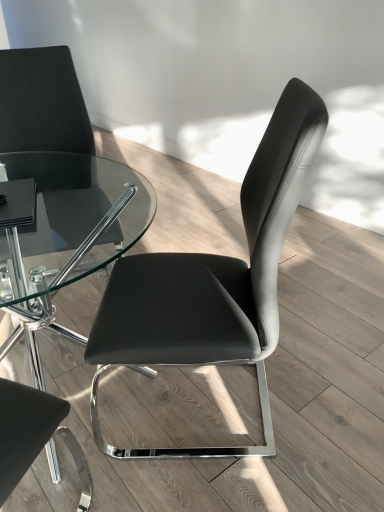
Measure the distance between black leather chair at upper left, the first chair in the left-to-right sequence, and camera.

black leather chair at upper left, the first chair in the left-to-right sequence, is 1.23 meters from camera.

In order to face black leather chair at upper left, the first chair in the left-to-right sequence, should I rotate leftwards or rightwards?

Turn left approximately 18.115 degrees to face it.

This screenshot has width=384, height=512. What do you see at coordinates (51, 181) in the screenshot? I see `black leather chair at upper left, which ranks as the second chair in right-to-left order` at bounding box center [51, 181].

This screenshot has height=512, width=384. Identify the location of black leather chair at upper left, which ranks as the second chair in right-to-left order. (51, 181).

Describe the element at coordinates (214, 282) in the screenshot. I see `black leather chair at center, the first chair viewed from the right` at that location.

This screenshot has width=384, height=512. In order to click on black leather chair at center, the first chair viewed from the right in this screenshot , I will do pyautogui.click(x=214, y=282).

Find the location of `black leather chair at upper left, which ranks as the second chair in right-to-left order`. black leather chair at upper left, which ranks as the second chair in right-to-left order is located at coordinates (51, 181).

Considering the relative positions of black leather chair at center, which is the 2th chair from left to right, and black leather chair at upper left, which ranks as the second chair in right-to-left order, in the image provided, is black leather chair at center, which is the 2th chair from left to right, to the left of black leather chair at upper left, which ranks as the second chair in right-to-left order, from the viewer's perspective?

No, black leather chair at center, which is the 2th chair from left to right, is not to the left of black leather chair at upper left, which ranks as the second chair in right-to-left order.

Between black leather chair at center, which is the 2th chair from left to right, and black leather chair at upper left, which ranks as the second chair in right-to-left order, which one is positioned in front?

black leather chair at center, which is the 2th chair from left to right, is more forward.

Considering the positions of points (147, 317) and (38, 58), is point (147, 317) farther from camera compared to point (38, 58)?

No, it is in front of (38, 58).

From the image's perspective, between black leather chair at center, which is the 2th chair from left to right, and black leather chair at upper left, the first chair in the left-to-right sequence, who is located below?

black leather chair at center, which is the 2th chair from left to right, from the image's perspective.

From a real-world perspective, is black leather chair at center, the first chair viewed from the right, physically above black leather chair at upper left, the first chair in the left-to-right sequence?

Yes.

Is black leather chair at center, which is the 2th chair from left to right, thinner than black leather chair at upper left, the first chair in the left-to-right sequence?

No.

Is black leather chair at center, which is the 2th chair from left to right, taller or shorter than black leather chair at upper left, which ranks as the second chair in right-to-left order?

Considering their sizes, black leather chair at center, which is the 2th chair from left to right, has less height than black leather chair at upper left, which ranks as the second chair in right-to-left order.

Which of these two, black leather chair at center, which is the 2th chair from left to right, or black leather chair at upper left, the first chair in the left-to-right sequence, is smaller?

With smaller size is black leather chair at center, which is the 2th chair from left to right.

Is black leather chair at center, the first chair viewed from the right, inside or outside of black leather chair at upper left, which ranks as the second chair in right-to-left order?

black leather chair at center, the first chair viewed from the right, is outside black leather chair at upper left, which ranks as the second chair in right-to-left order.

Is black leather chair at center, the first chair viewed from the right, placed right next to black leather chair at upper left, the first chair in the left-to-right sequence?

black leather chair at center, the first chair viewed from the right, is not next to black leather chair at upper left, the first chair in the left-to-right sequence, and they're not touching.

Is black leather chair at center, which is the 2th chair from left to right, turned away from black leather chair at upper left, the first chair in the left-to-right sequence?

No, black leather chair at center, which is the 2th chair from left to right, is not facing the opposite direction of black leather chair at upper left, the first chair in the left-to-right sequence.

How different are the orientations of black leather chair at center, which is the 2th chair from left to right, and black leather chair at upper left, the first chair in the left-to-right sequence, in degrees?

There is a 113-degree angle between the facing directions of black leather chair at center, which is the 2th chair from left to right, and black leather chair at upper left, the first chair in the left-to-right sequence.

Where is `chair above the black leather chair at center, the first chair viewed from the right (from the image's perspective)`? chair above the black leather chair at center, the first chair viewed from the right (from the image's perspective) is located at coordinates (51, 181).

Which is more to the right, black leather chair at upper left, the first chair in the left-to-right sequence, or black leather chair at center, the first chair viewed from the right?

black leather chair at center, the first chair viewed from the right.

In the scene shown: Between black leather chair at upper left, which ranks as the second chair in right-to-left order, and black leather chair at center, which is the 2th chair from left to right, which one is positioned behind?

black leather chair at upper left, which ranks as the second chair in right-to-left order.

Which is closer, (88, 139) or (178, 300)?

Positioned in front is point (178, 300).

From the image's perspective, would you say black leather chair at upper left, which ranks as the second chair in right-to-left order, is shown under black leather chair at center, which is the 2th chair from left to right?

No, from the image's perspective, black leather chair at upper left, which ranks as the second chair in right-to-left order, is not below black leather chair at center, which is the 2th chair from left to right.

From a real-world perspective, which object stands above the other?

black leather chair at center, which is the 2th chair from left to right.

In terms of width, does black leather chair at upper left, the first chair in the left-to-right sequence, look wider or thinner when compared to black leather chair at center, which is the 2th chair from left to right?

In the image, black leather chair at upper left, the first chair in the left-to-right sequence, appears to be more narrow than black leather chair at center, which is the 2th chair from left to right.

Looking at this image, between black leather chair at upper left, which ranks as the second chair in right-to-left order, and black leather chair at center, which is the 2th chair from left to right, which one has more height?

Standing taller between the two is black leather chair at upper left, which ranks as the second chair in right-to-left order.

Which of these two, black leather chair at upper left, the first chair in the left-to-right sequence, or black leather chair at center, which is the 2th chair from left to right, is bigger?

black leather chair at upper left, the first chair in the left-to-right sequence, is bigger.

Consider the image. Is black leather chair at center, which is the 2th chair from left to right, inside black leather chair at upper left, the first chair in the left-to-right sequence?

No, black leather chair at center, which is the 2th chair from left to right, is not inside black leather chair at upper left, the first chair in the left-to-right sequence.

Are black leather chair at upper left, which ranks as the second chair in right-to-left order, and black leather chair at center, the first chair viewed from the right, beside each other?

No, black leather chair at upper left, which ranks as the second chair in right-to-left order, is not with black leather chair at center, the first chair viewed from the right.

Is black leather chair at upper left, which ranks as the second chair in right-to-left order, oriented away from black leather chair at center, the first chair viewed from the right?

black leather chair at upper left, which ranks as the second chair in right-to-left order, is not turned away from black leather chair at center, the first chair viewed from the right.

Locate an element on the screen. This screenshot has width=384, height=512. chair lying above the black leather chair at center, which is the 2th chair from left to right (from the image's perspective) is located at coordinates (51, 181).

This screenshot has height=512, width=384. Find the location of `chair on the right of black leather chair at upper left, which ranks as the second chair in right-to-left order`. chair on the right of black leather chair at upper left, which ranks as the second chair in right-to-left order is located at coordinates (214, 282).

In the image, there is a black leather chair at upper left, which ranks as the second chair in right-to-left order. Identify the location of chair below it (from the image's perspective). This screenshot has width=384, height=512. (214, 282).